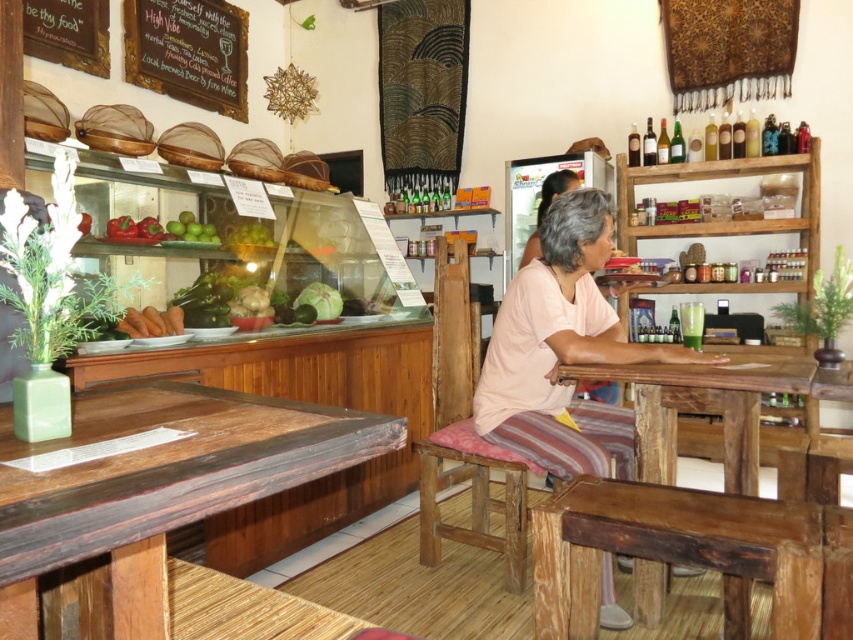
You are standing at the entrance of the cafe and want to sit down. There is a wooden chair at center. Can you walk directly to it without moving around any obstacles?

The wooden chair at center is 2.05 meters away from camera. Since there are no obstacles mentioned in the scene description between you and the chair, you can walk directly to it.

You are a customer sitting at the wooden chair at center in a rustic cafe. You want to read the menu written on the wooden chalkboard at upper left. Can you see the chalkboard clearly from your current position?

The wooden chair at center is in front of the wooden chalkboard at upper left, so you are facing away from it and would need to turn around to see the menu clearly.

You are a customer entering the cafe and need to sit down. There is a wooden chair at center and green matte apples at upper center. Which object is taller and thus might require you to bend down less when sitting?

The wooden chair at center is taller than the green matte apples at upper center, so you would not need to bend down as much when sitting on the wooden chair at center.